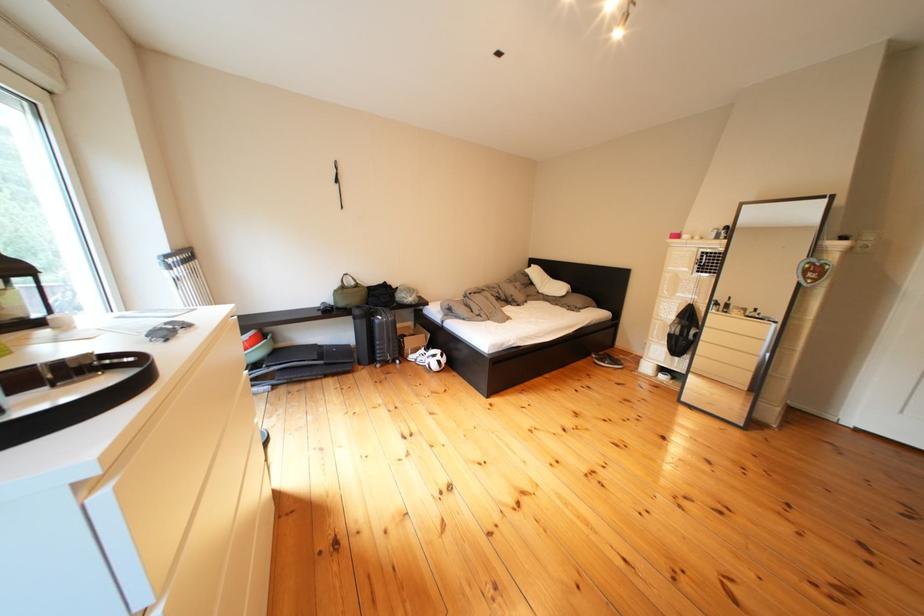
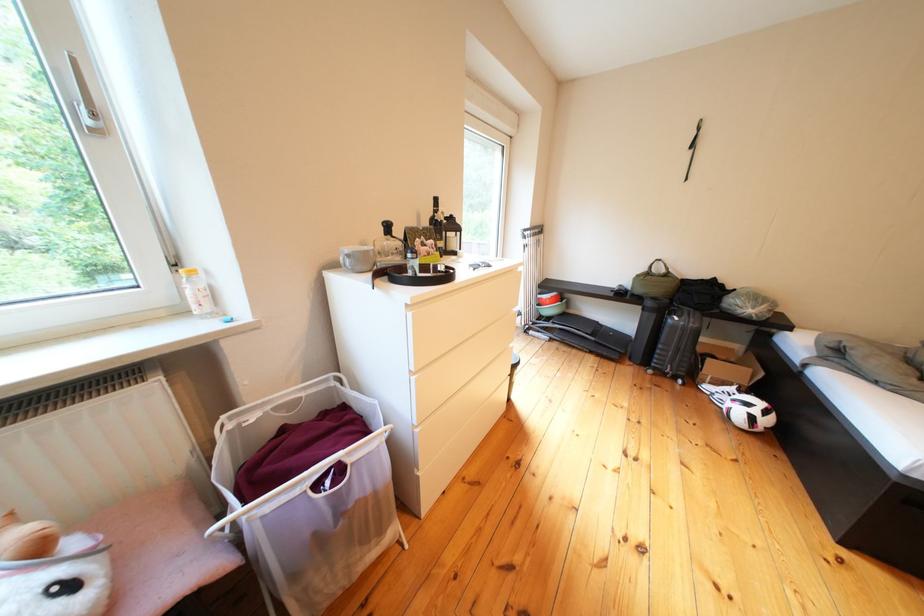
Question: The camera is either moving clockwise (left) or counter-clockwise (right) around the object. The first image is from the beginning of the video and the second image is from the end. Is the camera moving left or right when shooting the video?

Choices:
 (A) Left
 (B) Right

Answer: (B)